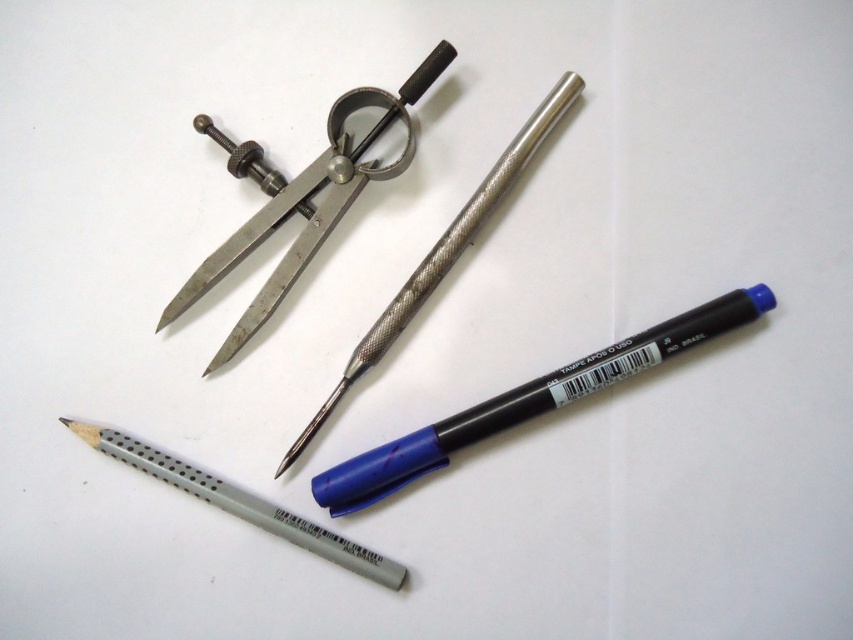
Question: Which point is closer to the camera?

Choices:
 (A) metallic textured pencil at center
 (B) metallic/textured scissors at upper center
 (C) blue plastic pen at lower right
 (D) gray matte pencil at lower center

Answer: (C)

Question: Does blue plastic pen at lower right appear over metallic textured pencil at center?

Choices:
 (A) no
 (B) yes

Answer: (A)

Question: Which of the following is the farthest from the observer?

Choices:
 (A) (289, 273)
 (B) (117, 451)
 (C) (482, 180)
 (D) (608, 378)

Answer: (A)

Question: Can you confirm if blue plastic pen at lower right is positioned to the right of metallic textured pencil at center?

Choices:
 (A) no
 (B) yes

Answer: (B)

Question: Can you confirm if metallic/textured scissors at upper center is smaller than metallic textured pencil at center?

Choices:
 (A) yes
 (B) no

Answer: (A)

Question: Which object is the farthest from the metallic/textured scissors at upper center?

Choices:
 (A) metallic textured pencil at center
 (B) gray matte pencil at lower center
 (C) blue plastic pen at lower right

Answer: (C)